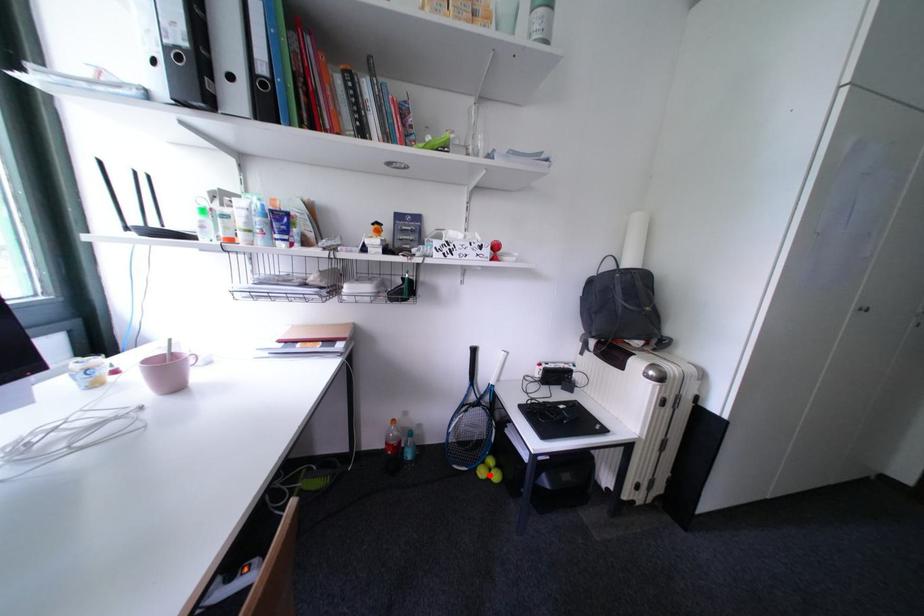
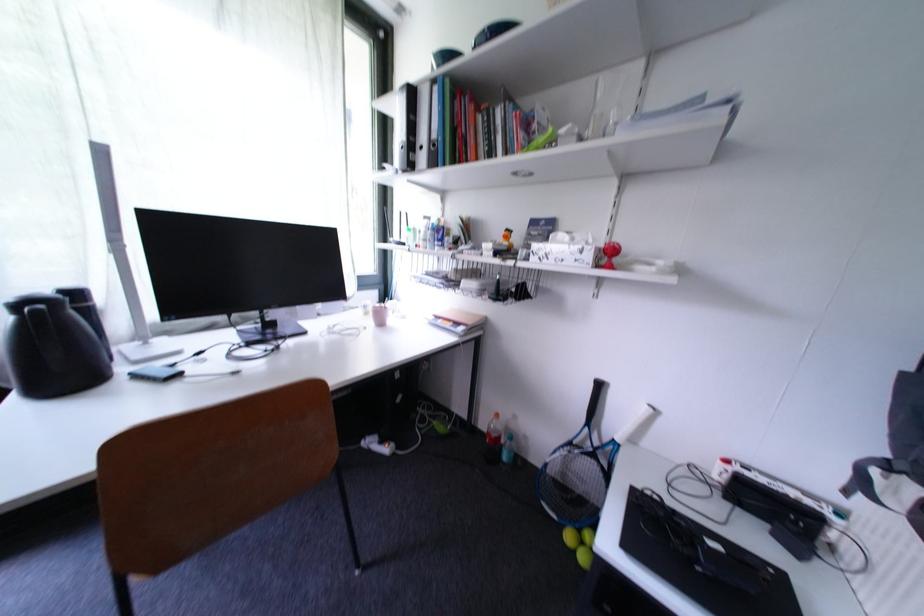
In the second image, find the point that corresponds to the highlighted location in the first image.

(578, 540)